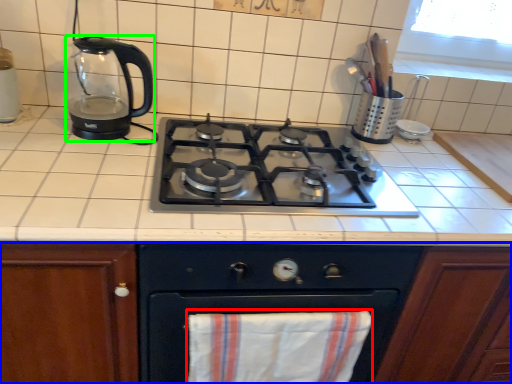
Question: Which object is positioned farthest from beach towel (highlighted by a red box)? Select from cabinetry (highlighted by a blue box) and kitchen appliance (highlighted by a green box).

Choices:
 (A) cabinetry
 (B) kitchen appliance

Answer: (B)